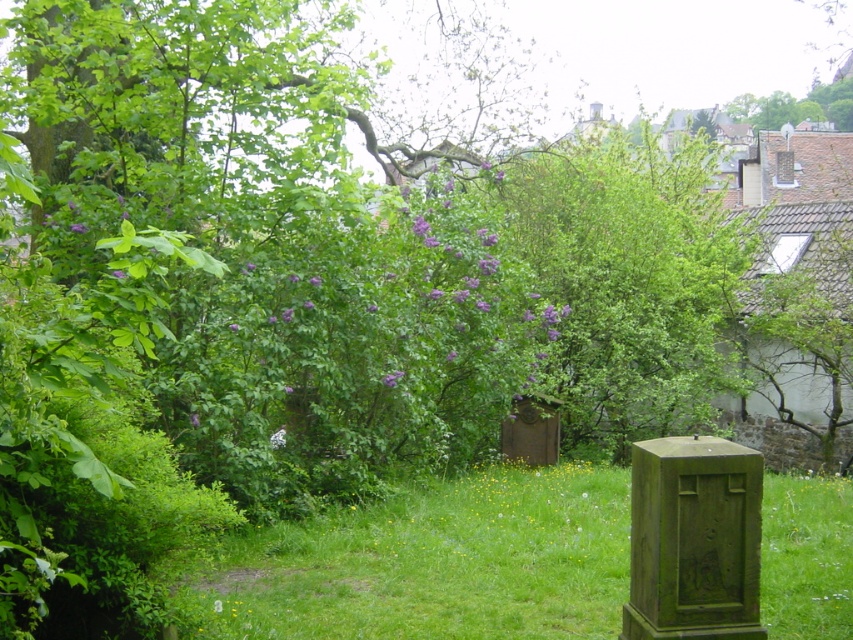
You are standing in the garden and want to place a small statue between the two points, point (335, 512) and point (563, 390). Which point should the statue be closer to so it appears in front of the other?

The statue should be placed closer to point (335, 512) because it is in front of point (563, 390).

You are planning to place a new bench in the garden between the green leafy tree at center and the smooth stone gravestone at center. The bench requires 10 feet of space to fit properly. Based on the scene description, will there be enough space between these two objects for the bench?

The green leafy tree at center and the smooth stone gravestone at center are 9.71 feet apart, which is slightly less than the required 10 feet. Therefore, there is not enough space to place the bench between them.

You are planning to install a small garden path between the green grassy at center and the green leafy tree at center. If the path needs to be at least 30 feet long to accommodate all the plants, will the existing space between them be sufficient?

The distance between the green grassy at center and the green leafy tree at center is 36.26 feet, which is longer than the required 30 feet. Therefore, the existing space is sufficient to accommodate the garden path.